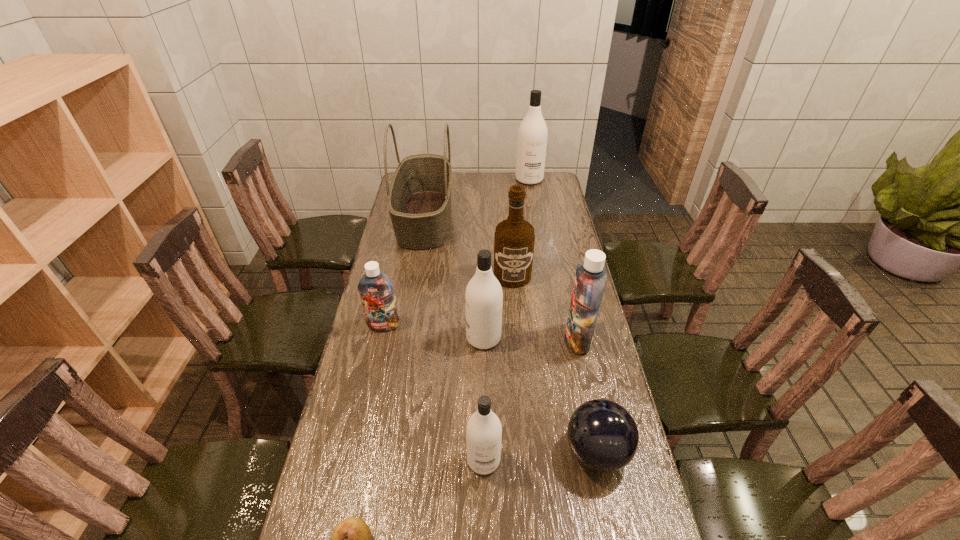
The image size is (960, 540). What are the coordinates of `the nearest white shampoo` in the screenshot? It's located at (484, 431).

What are the coordinates of `bowling ball` in the screenshot? It's located at (602, 434).

Locate an element on the screen. Image resolution: width=960 pixels, height=540 pixels. black bowling ball is located at coordinates (602, 434).

Identify the location of vacant space located 0.120m on the front-facing side of the tallest shampoo. (533, 199).

Find the location of `vacant space positioned on the right of the second farthest object`. vacant space positioned on the right of the second farthest object is located at coordinates (525, 218).

Find the location of a particular element. The width and height of the screenshot is (960, 540). vacant space located on the label of the brown alcohol is located at coordinates (520, 375).

You are a GUI agent. You are given a task and a screenshot of the screen. Output one action in this format:
    pyautogui.click(x=<x>, y=<y>)
    Task: Click on the vacant area situated 0.070m on the front label of the bigger blue shampoo
    This screenshot has width=960, height=540.
    Given the screenshot: What is the action you would take?
    pyautogui.click(x=544, y=340)

Locate an element on the screen. The width and height of the screenshot is (960, 540). vacant space located on the front label of the bigger blue shampoo is located at coordinates (461, 340).

Find the location of a particular element. This screenshot has width=960, height=540. vacant space located on the front label of the bigger blue shampoo is located at coordinates (451, 340).

Locate an element on the screen. The height and width of the screenshot is (540, 960). blank area located 0.340m on the front-facing side of the second farthest white shampoo is located at coordinates (365, 338).